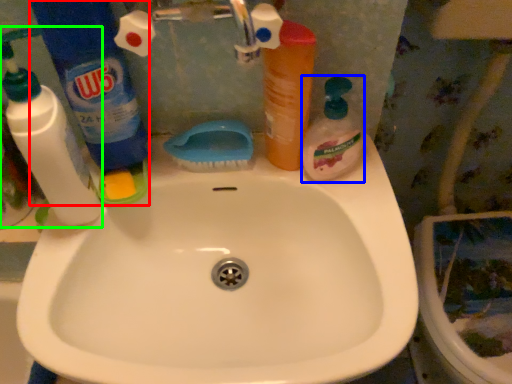
Question: Estimate the real-world distances between objects in this image. Which object is farther from cleaning product (highlighted by a red box), cleaning product (highlighted by a blue box) or cleaning product (highlighted by a green box)?

Choices:
 (A) cleaning product
 (B) cleaning product

Answer: (A)